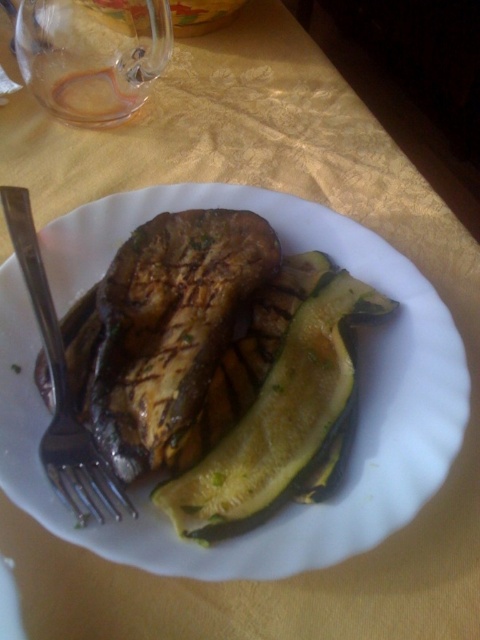
The image size is (480, 640). Describe the element at coordinates (362, 410) in the screenshot. I see `slightly charred eggplant at center` at that location.

Is point (254, 189) farther from camera compared to point (67, 404)?

Yes, point (254, 189) is behind point (67, 404).

You are a GUI agent. You are given a task and a screenshot of the screen. Output one action in this format:
    pyautogui.click(x=<x>, y=<y>)
    Task: Click on the slightly charred eggplant at center
    This screenshot has width=480, height=640.
    Given the screenshot: What is the action you would take?
    pyautogui.click(x=362, y=410)

What do you see at coordinates (362, 410) in the screenshot? I see `slightly charred eggplant at center` at bounding box center [362, 410].

Measure the distance from slightly charred eggplant at center to grilled brown steak at center.

The distance of slightly charred eggplant at center from grilled brown steak at center is 3.01 inches.

Locate an element on the screen. The image size is (480, 640). slightly charred eggplant at center is located at coordinates click(x=362, y=410).

This screenshot has width=480, height=640. I want to click on slightly charred eggplant at center, so [362, 410].

Does green smooth zucchini at center appear under silver metallic fork at lower left?

Indeed, green smooth zucchini at center is positioned under silver metallic fork at lower left.

Which is in front, point (230, 468) or point (75, 417)?

Point (230, 468) is more forward.

Locate an element on the screen. The width and height of the screenshot is (480, 640). green smooth zucchini at center is located at coordinates (276, 420).